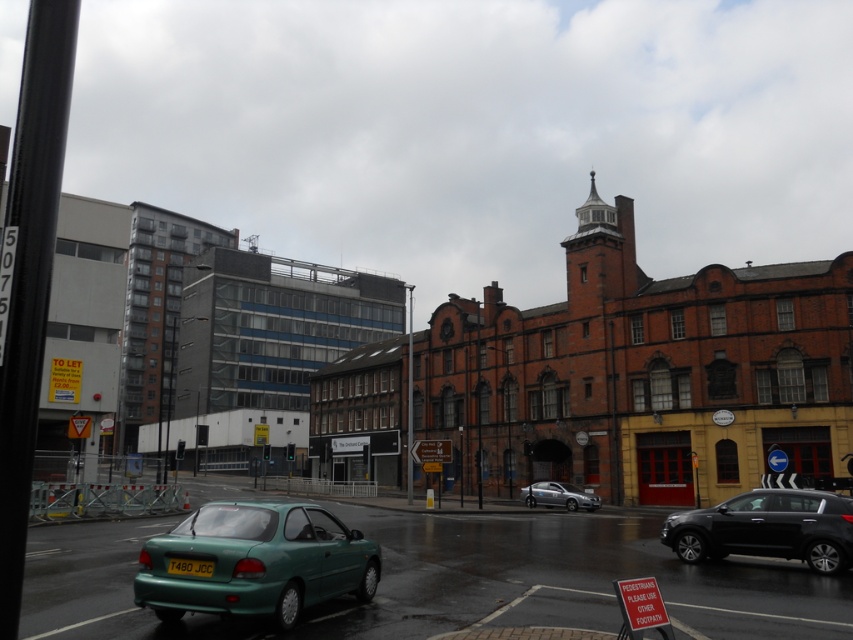
Question: Estimate the real-world distances between objects in this image. Which object is closer to the silver metallic sedan at center?

Choices:
 (A) teal glossy hatchback at center
 (B) shiny black suv at lower right

Answer: (A)

Question: Can you confirm if shiny black suv at lower right is wider than silver metallic sedan at center?

Choices:
 (A) yes
 (B) no

Answer: (B)

Question: Estimate the real-world distances between objects in this image. Which object is farther from the teal glossy hatchback at center?

Choices:
 (A) silver metallic sedan at center
 (B) shiny black suv at lower right
 (C) yellow matte license plate at lower center

Answer: (A)

Question: Which point appears farthest from the camera in this image?

Choices:
 (A) (323, 564)
 (B) (212, 568)
 (C) (582, 506)
 (D) (815, 520)

Answer: (C)

Question: Is teal glossy hatchback at center bigger than yellow matte license plate at lower center?

Choices:
 (A) yes
 (B) no

Answer: (A)

Question: Is teal glossy hatchback at center further to the viewer compared to silver metallic sedan at center?

Choices:
 (A) no
 (B) yes

Answer: (A)